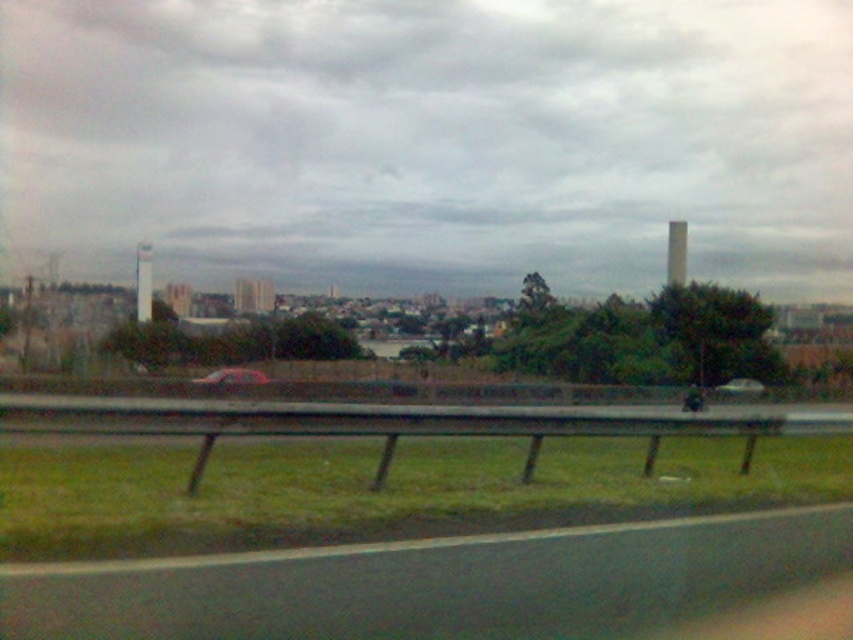
You are a drone operator trying to capture a photo of the black asphalt highway at lower center. Your drone is currently hovering 6 meters above the ground. To ensure the highway is in focus, you need to adjust the drone to be exactly at the same height as the highway. How should you adjust the drone?

The black asphalt highway at lower center is 5.86 meters from the camera. Since the drone is currently at 6 meters, you should lower it by 0.14 meters to match the highway height for proper focus.

You are a passenger in a car and looking out the window. You see the black asphalt highway at lower center and the metallic silver sedan at center. Which object is closer to you?

The black asphalt highway at lower center is closer to the viewer than the metallic silver sedan at center.